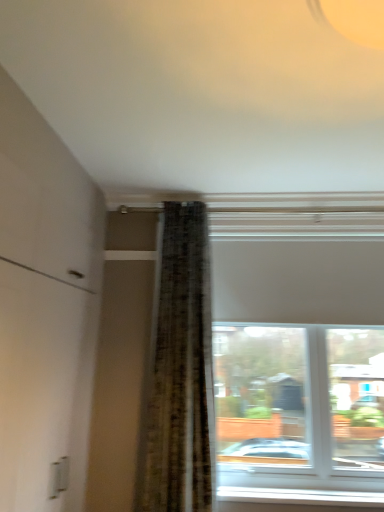
This screenshot has height=512, width=384. Describe the element at coordinates (242, 389) in the screenshot. I see `white matte window at upper center` at that location.

The image size is (384, 512). Find the location of `white matte window at upper center`. white matte window at upper center is located at coordinates (242, 389).

Measure the distance between point (341,498) and camera.

A distance of 8.79 feet exists between point (341,498) and camera.

In the scene shown: Measure the distance between white plastic window sill at lower center and camera.

A distance of 2.58 meters exists between white plastic window sill at lower center and camera.

At what (x,y) coordinates should I click in order to perform the action: click on white plastic window sill at lower center. Please return your answer as a coordinate pair (x, y). This screenshot has height=512, width=384. Looking at the image, I should click on (300, 497).

Image resolution: width=384 pixels, height=512 pixels. What do you see at coordinates (300, 497) in the screenshot? I see `white plastic window sill at lower center` at bounding box center [300, 497].

Find the location of a particular element. The image size is (384, 512). white matte window at upper center is located at coordinates (242, 389).

Which is more to the left, white plastic window sill at lower center or white matte window at upper center?

white plastic window sill at lower center is more to the left.

Which is behind, white plastic window sill at lower center or white matte window at upper center?

Positioned behind is white plastic window sill at lower center.

Between point (292, 504) and point (158, 455), which one is positioned behind?

Positioned behind is point (292, 504).

From the image's perspective, which is below, white plastic window sill at lower center or white matte window at upper center?

white plastic window sill at lower center appears lower in the image.

From a real-world perspective, is white plastic window sill at lower center on white matte window at upper center?

No.

Based on the photo, can you confirm if white plastic window sill at lower center is wider than white matte window at upper center?

Incorrect, the width of white plastic window sill at lower center does not surpass that of white matte window at upper center.

Which of these two, white plastic window sill at lower center or white matte window at upper center, stands shorter?

white plastic window sill at lower center is shorter.

Between white plastic window sill at lower center and white matte window at upper center, which one has larger size?

With larger size is white matte window at upper center.

Is white plastic window sill at lower center inside or outside of white matte window at upper center?

white plastic window sill at lower center fits inside white matte window at upper center.

Is white plastic window sill at lower center beside white matte window at upper center?

No.

In the scene shown: Could you tell me if white plastic window sill at lower center is turned towards white matte window at upper center?

No, white plastic window sill at lower center does not turn towards white matte window at upper center.

What's the angular difference between white plastic window sill at lower center and white matte window at upper center's facing directions?

The angle between the facing direction of white plastic window sill at lower center and the facing direction of white matte window at upper center is 0.569 degrees.

I want to click on window sill located underneath the white matte window at upper center (from a real-world perspective), so click(300, 497).

Is white matte window at upper center to the left of white plastic window sill at lower center from the viewer's perspective?

Incorrect, white matte window at upper center is not on the left side of white plastic window sill at lower center.

Which object is closer to the camera taking this photo, white matte window at upper center or white plastic window sill at lower center?

Positioned in front is white matte window at upper center.

Is point (174, 243) closer to camera compared to point (218, 493)?

No, it is not.

From the image's perspective, between white matte window at upper center and white plastic window sill at lower center, who is located below?

white plastic window sill at lower center appears lower in the image.

From a real-world perspective, between white matte window at upper center and white plastic window sill at lower center, who is vertically lower?

In real-world perspective, white plastic window sill at lower center is lower.

Considering the sizes of objects white matte window at upper center and white plastic window sill at lower center in the image provided, who is wider, white matte window at upper center or white plastic window sill at lower center?

white matte window at upper center is wider.

Which of these two, white matte window at upper center or white plastic window sill at lower center, stands shorter?

white plastic window sill at lower center.

Considering the sizes of white matte window at upper center and white plastic window sill at lower center in the image, is white matte window at upper center bigger or smaller than white plastic window sill at lower center?

In the image, white matte window at upper center appears to be larger than white plastic window sill at lower center.

Is white plastic window sill at lower center inside white matte window at upper center?

That's correct, white plastic window sill at lower center is inside white matte window at upper center.

Is white matte window at upper center next to white plastic window sill at lower center and touching it?

white matte window at upper center and white plastic window sill at lower center are not in contact.

Is white matte window at upper center aimed at white plastic window sill at lower center?

No, white matte window at upper center does not turn towards white plastic window sill at lower center.

Identify the location of window lying in front of the white plastic window sill at lower center. (242, 389).

In order to click on window sill that appears below the white matte window at upper center (from a real-world perspective) in this screenshot , I will do `click(300, 497)`.

Where is `window above the white plastic window sill at lower center (from a real-world perspective)`? window above the white plastic window sill at lower center (from a real-world perspective) is located at coordinates (242, 389).